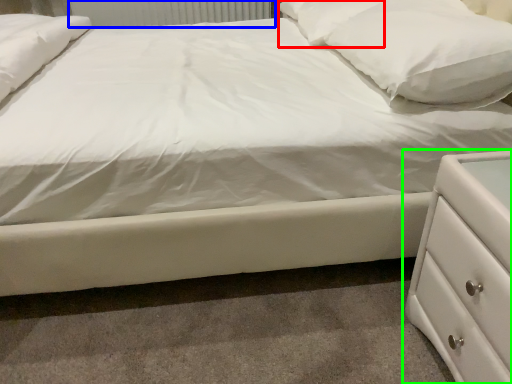
Question: Which object is positioned closest to pillow (highlighted by a red box)? Select from radiator (highlighted by a blue box) and chest of drawers (highlighted by a green box).

Choices:
 (A) radiator
 (B) chest of drawers

Answer: (B)